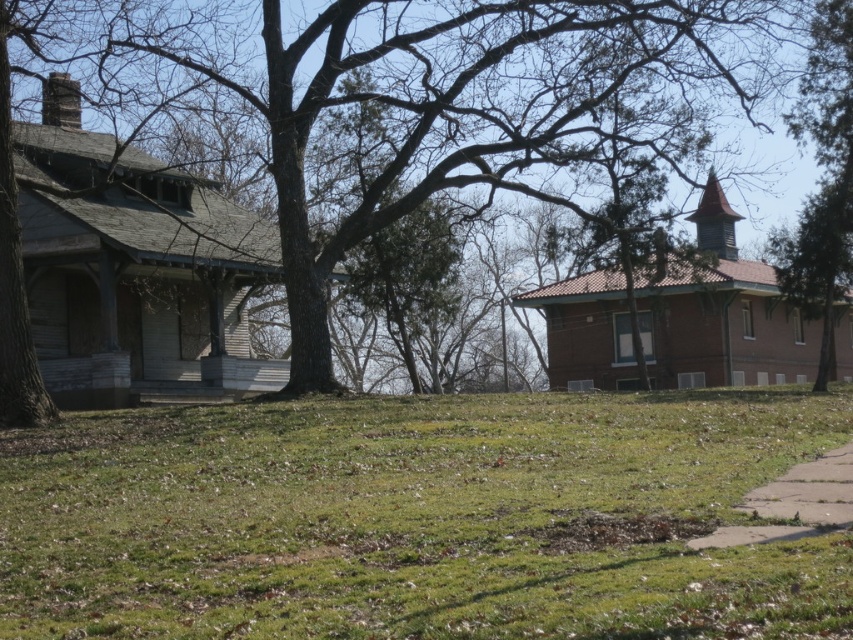
Question: Does green grass at center have a lesser width compared to brown wood tree at center?

Choices:
 (A) no
 (B) yes

Answer: (B)

Question: Among these points, which one is farthest from the camera?

Choices:
 (A) (422, 12)
 (B) (827, 284)
 (C) (811, 461)
 (D) (27, 508)

Answer: (A)

Question: Which of the following is the farthest from the observer?

Choices:
 (A) (329, 56)
 (B) (531, 460)
 (C) (839, 65)
 (D) (843, 451)

Answer: (C)

Question: Which of the following is the farthest from the observer?

Choices:
 (A) gray concrete sidewalk at lower right
 (B) green textured tree at right
 (C) brown wood tree at center

Answer: (B)

Question: Is green grass at center closer to the viewer compared to gray concrete sidewalk at lower right?

Choices:
 (A) yes
 (B) no

Answer: (A)

Question: Does brown wood tree at center appear under green textured tree at right?

Choices:
 (A) yes
 (B) no

Answer: (B)